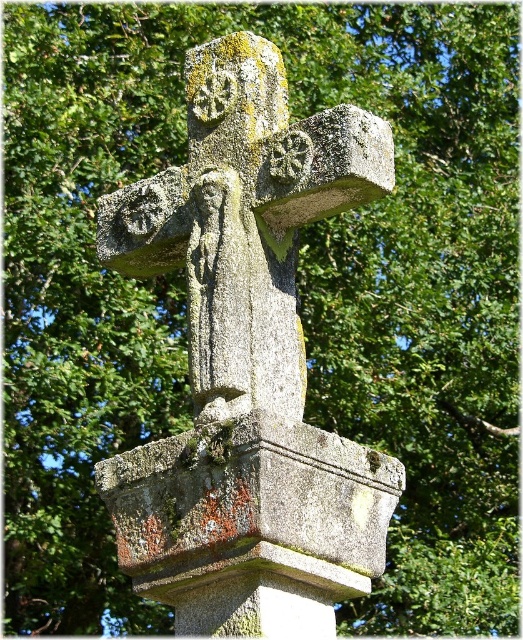
You are standing in front of the gray stone cross at center and want to place a small offering on the gray stone pedestal at center. Can you directly place the offering on the pedestal without moving the cross?

The gray stone pedestal at center is behind the gray stone cross at center, so you cannot directly access the pedestal without moving the cross.

You are a landscape architect designing a garden path that needs to pass between the gray stone cross at center and the gray stone pedestal at center. The path must be 2 meters wide. Can the path fit between them based on their sizes?

The gray stone cross at center is taller than the gray stone pedestal at center, but the description does not provide information about their widths. Therefore, it is impossible to determine if the 2 meter wide path can fit between them based on the given details.